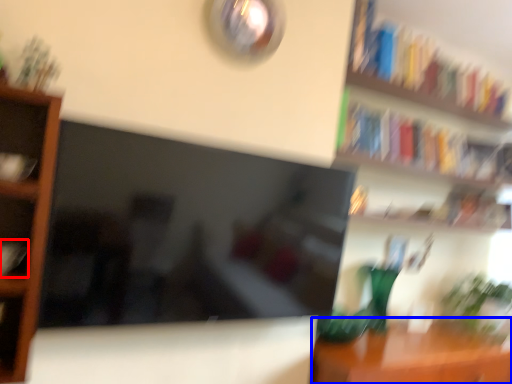
Question: Which point is further to the camera, book (highlighted by a red box) or table (highlighted by a blue box)?

Choices:
 (A) book
 (B) table

Answer: (B)